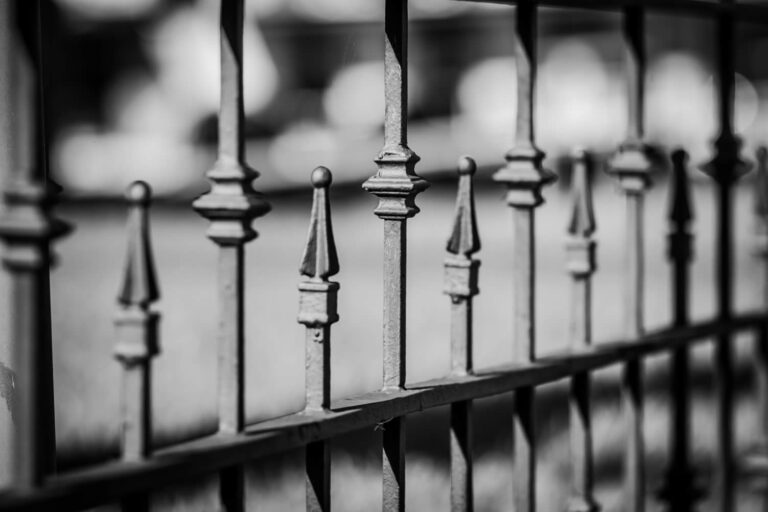
This screenshot has height=512, width=768. In order to click on rod in this screenshot , I will do `click(316, 368)`.